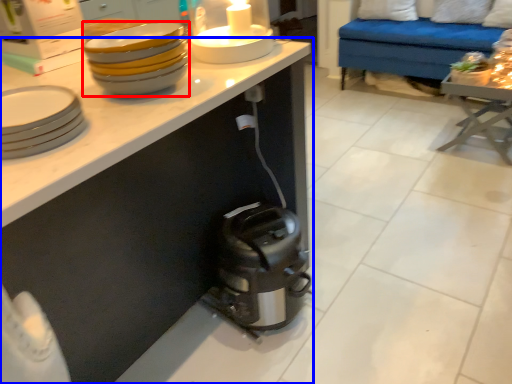
Question: Which object is closer to the camera taking this photo, tableware (highlighted by a red box) or cabinetry (highlighted by a blue box)?

Choices:
 (A) tableware
 (B) cabinetry

Answer: (B)